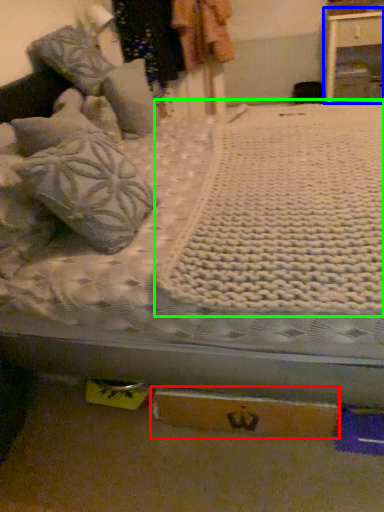
Question: Which object is the closest to the cardboard box (highlighted by a red box)? Choose among these: nightstand (highlighted by a blue box) or blanket (highlighted by a green box).

Choices:
 (A) nightstand
 (B) blanket

Answer: (B)